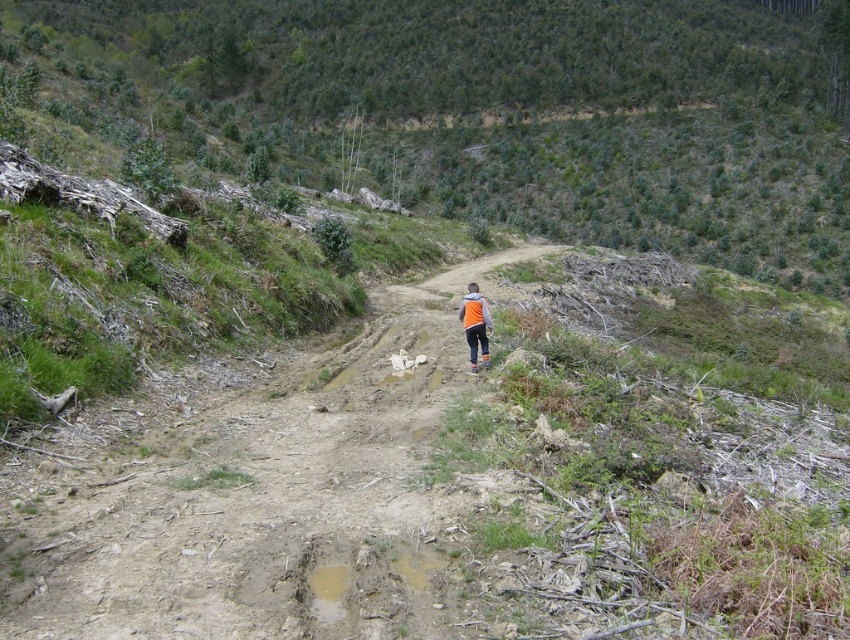
Question: Where is dirt path at center located in relation to orange fleece jacket at center in the image?

Choices:
 (A) below
 (B) above

Answer: (A)

Question: Which point is closer to the camera?

Choices:
 (A) orange fleece jacket at center
 (B) dirt path at center

Answer: (B)

Question: Can you confirm if dirt path at center is smaller than orange fleece jacket at center?

Choices:
 (A) no
 (B) yes

Answer: (A)

Question: Which point is farther to the camera?

Choices:
 (A) (476, 298)
 (B) (18, 468)

Answer: (A)

Question: Which point is farther to the camera?

Choices:
 (A) (476, 307)
 (B) (126, 634)

Answer: (A)

Question: Is dirt path at center to the right of orange fleece jacket at center from the viewer's perspective?

Choices:
 (A) yes
 (B) no

Answer: (B)